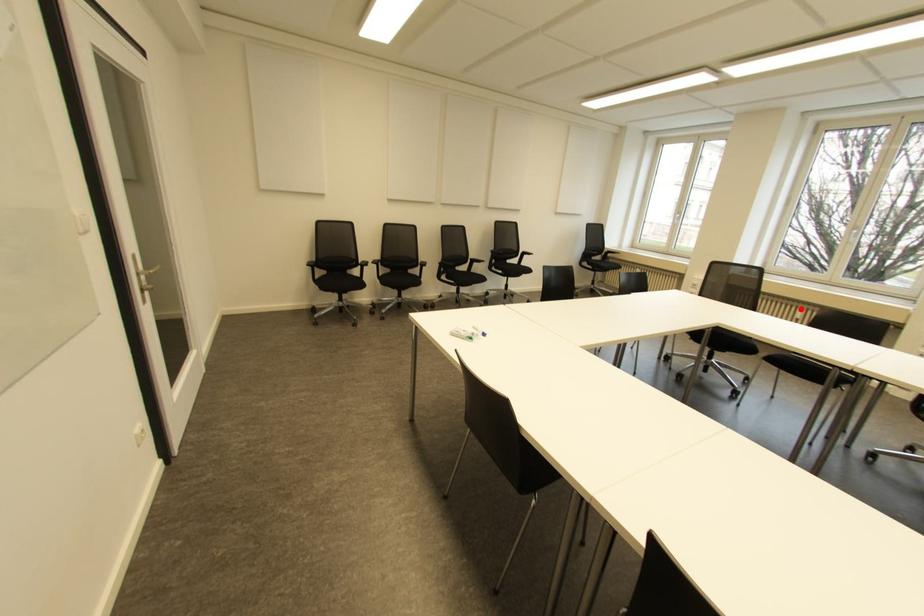
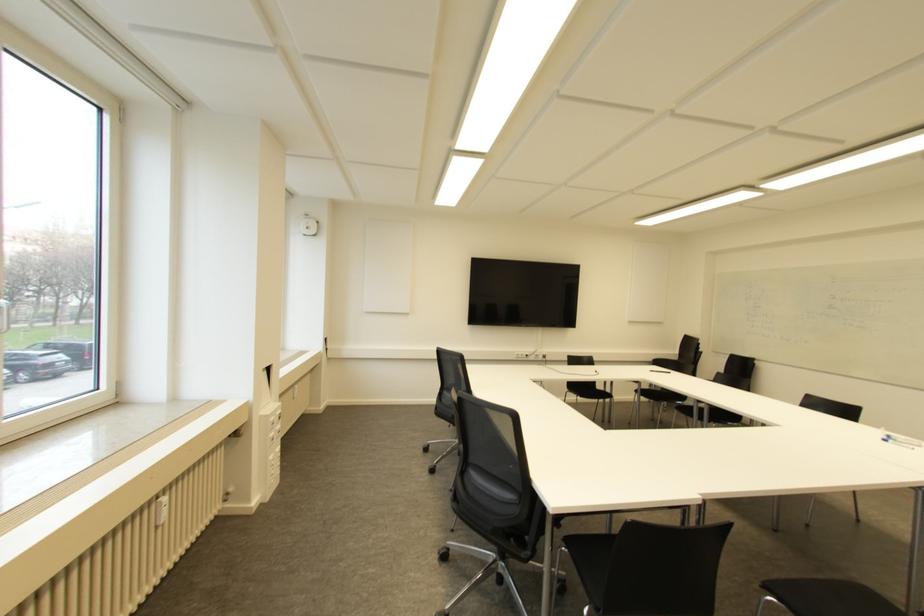
Locate, in the second image, the point that corresponds to the highlighted location in the first image.

(163, 499)